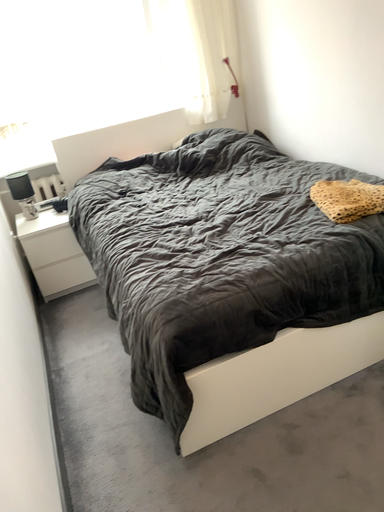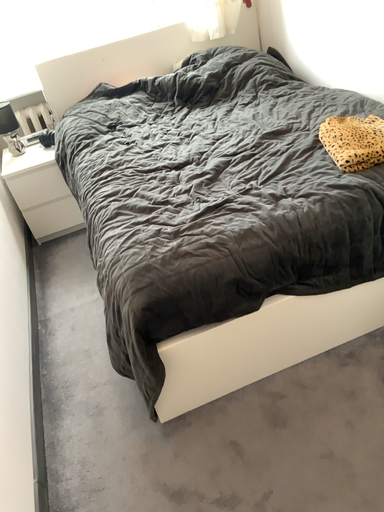
Question: Which way did the camera rotate in the video?

Choices:
 (A) rotated upward
 (B) rotated downward

Answer: (B)